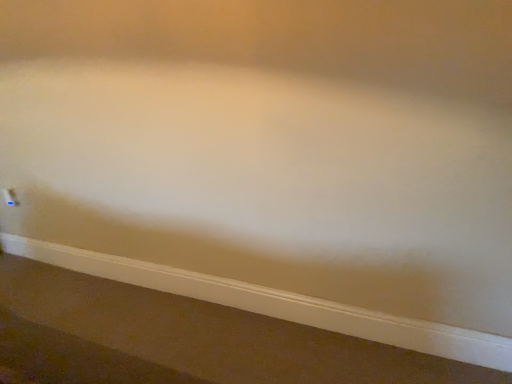
Question: Based on their sizes in the image, would you say white smooth baseboard at lower center is bigger or smaller than white plastic electric outlet at lower left?

Choices:
 (A) small
 (B) big

Answer: (B)

Question: Considering the positions of white smooth baseboard at lower center and white plastic electric outlet at lower left in the image, is white smooth baseboard at lower center wider or thinner than white plastic electric outlet at lower left?

Choices:
 (A) thin
 (B) wide

Answer: (B)

Question: Is white smooth baseboard at lower center inside the boundaries of white plastic electric outlet at lower left, or outside?

Choices:
 (A) inside
 (B) outside

Answer: (B)

Question: Looking at their shapes, would you say white plastic electric outlet at lower left is wider or thinner than white smooth baseboard at lower center?

Choices:
 (A) thin
 (B) wide

Answer: (A)

Question: Is white plastic electric outlet at lower left in front of or behind white smooth baseboard at lower center in the image?

Choices:
 (A) behind
 (B) front

Answer: (A)

Question: Considering the positions of point (7, 188) and point (118, 271), is point (7, 188) closer or farther from the camera than point (118, 271)?

Choices:
 (A) closer
 (B) farther

Answer: (B)

Question: Do you think white plastic electric outlet at lower left is within white smooth baseboard at lower center, or outside of it?

Choices:
 (A) outside
 (B) inside

Answer: (A)